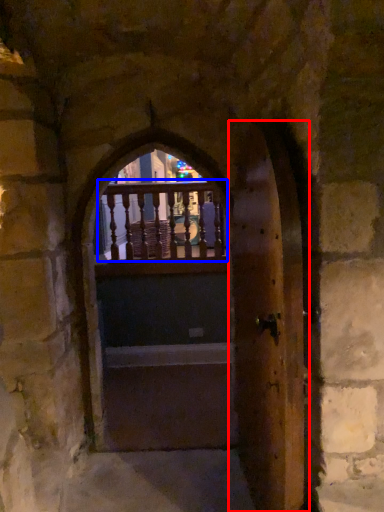
Question: Which object appears closest to the camera in this image, door (highlighted by a red box) or balcony (highlighted by a blue box)?

Choices:
 (A) door
 (B) balcony

Answer: (A)